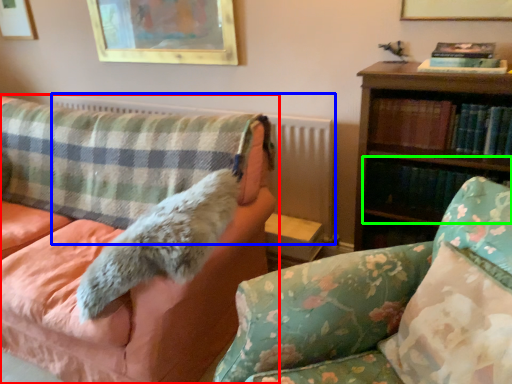
Question: Which object is the farthest from studio couch (highlighted by a red box)? Choose among these: radiator (highlighted by a blue box) or book (highlighted by a green box).

Choices:
 (A) radiator
 (B) book

Answer: (B)